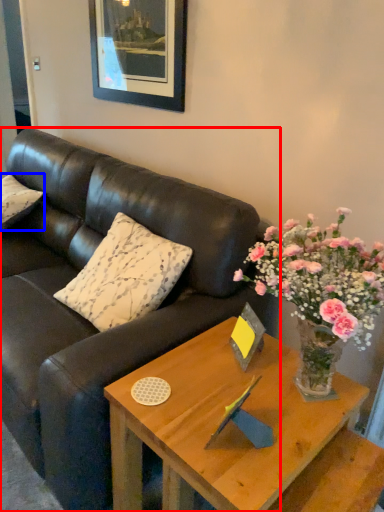
Question: Among these objects, which one is nearest to the camera, studio couch (highlighted by a red box) or pillow (highlighted by a blue box)?

Choices:
 (A) studio couch
 (B) pillow

Answer: (A)